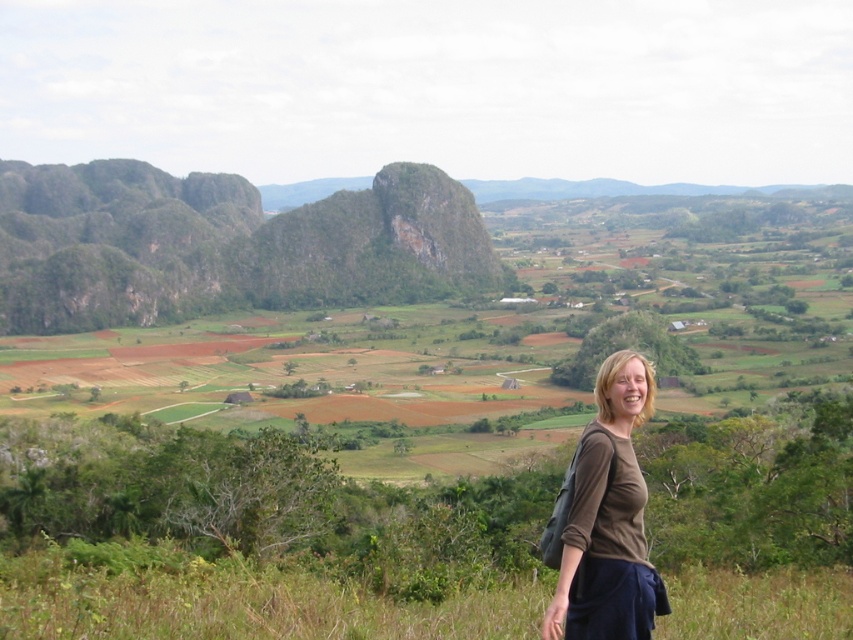
Question: Is green rock formation at upper left bigger than brown cotton shirt at lower right?

Choices:
 (A) yes
 (B) no

Answer: (A)

Question: Is green rock formation at upper left above brown cotton shirt at lower right?

Choices:
 (A) no
 (B) yes

Answer: (B)

Question: Is green rock formation at upper left wider than brown cotton shirt at lower right?

Choices:
 (A) yes
 (B) no

Answer: (A)